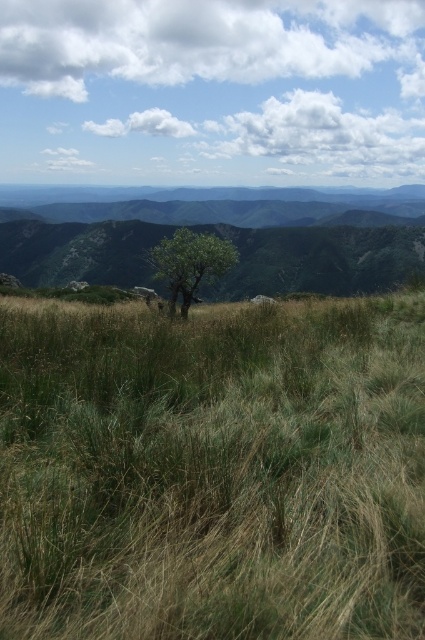
Is green grassy at center taller than green grassy hill at center?

No, green grassy at center is not taller than green grassy hill at center.

The height and width of the screenshot is (640, 425). What do you see at coordinates (212, 470) in the screenshot? I see `green grassy at center` at bounding box center [212, 470].

Find the location of a particular element. This screenshot has height=640, width=425. green grassy at center is located at coordinates (212, 470).

Between green grassy hill at center and green leafy tree at center, which one appears on the left side from the viewer's perspective?

Positioned to the left is green leafy tree at center.

The width and height of the screenshot is (425, 640). What do you see at coordinates (218, 234) in the screenshot? I see `green grassy hill at center` at bounding box center [218, 234].

The image size is (425, 640). Describe the element at coordinates (218, 234) in the screenshot. I see `green grassy hill at center` at that location.

In order to click on green grassy hill at center in this screenshot , I will do `click(218, 234)`.

Which is in front, point (292, 536) or point (181, 288)?

Point (292, 536)

Is green grassy at center above green leafy tree at center?

No, green grassy at center is not above green leafy tree at center.

Identify the location of green grassy at center. (212, 470).